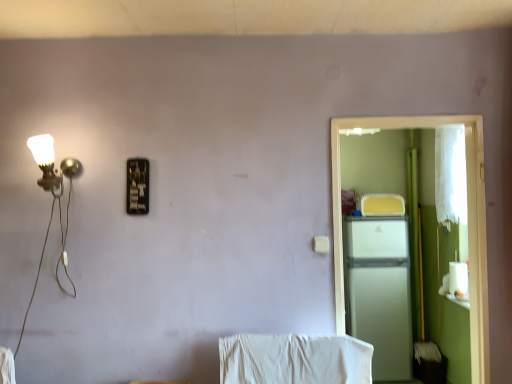
Question: Is point (373, 228) positioned closer to the camera than point (466, 117)?

Choices:
 (A) closer
 (B) farther

Answer: (B)

Question: Considering the positions of white matte refrigerator at right and white matte refrigerator at right in the image, is white matte refrigerator at right bigger or smaller than white matte refrigerator at right?

Choices:
 (A) big
 (B) small

Answer: (A)

Question: Is white matte refrigerator at right to the left or to the right of white matte refrigerator at right in the image?

Choices:
 (A) left
 (B) right

Answer: (B)

Question: Is white matte refrigerator at right taller or shorter than white matte refrigerator at right?

Choices:
 (A) short
 (B) tall

Answer: (B)

Question: Based on their sizes in the image, would you say white matte refrigerator at right is bigger or smaller than white matte refrigerator at right?

Choices:
 (A) small
 (B) big

Answer: (A)

Question: Would you say white matte refrigerator at right is to the left or to the right of white matte refrigerator at right in the picture?

Choices:
 (A) left
 (B) right

Answer: (A)

Question: Is white matte refrigerator at right situated inside white matte refrigerator at right or outside?

Choices:
 (A) inside
 (B) outside

Answer: (B)